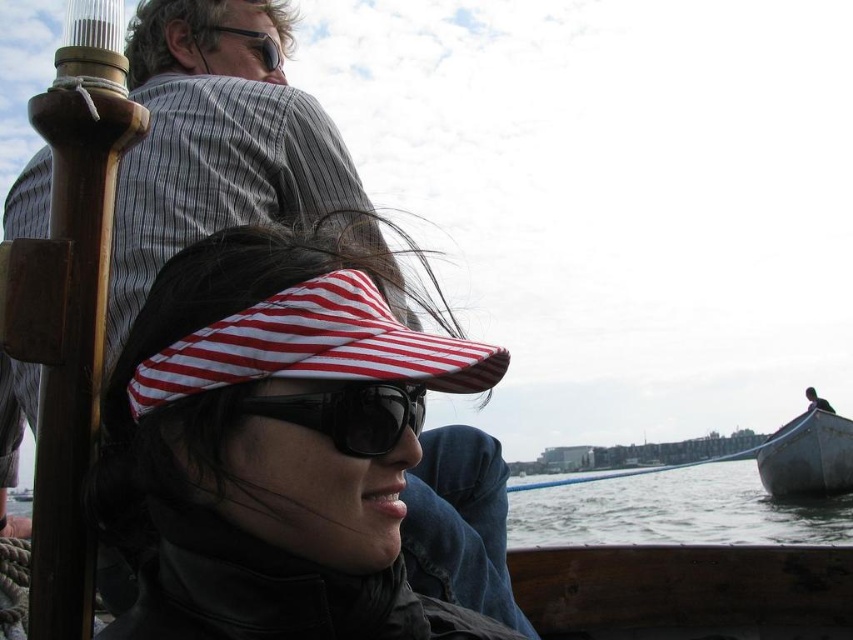
Question: Which point is farther from the camera taking this photo?

Choices:
 (A) (699, 532)
 (B) (144, 336)
 (C) (376, 428)
 (D) (833, 490)

Answer: (A)

Question: Which is farther from the black plastic sunglasses at center?

Choices:
 (A) clear water at lower right
 (B) striped fabric sun visor at center
 (C) dark gray wooden boat at lower right

Answer: (A)

Question: Does striped fabric sun visor at center lie in front of clear water at lower right?

Choices:
 (A) no
 (B) yes

Answer: (B)

Question: Is striped fabric sun visor at center further to the viewer compared to black plastic sunglasses at center?

Choices:
 (A) yes
 (B) no

Answer: (B)

Question: Is black plastic sunglasses at center further to camera compared to dark gray wooden boat at lower right?

Choices:
 (A) no
 (B) yes

Answer: (A)

Question: Which point appears closest to the camera in this image?

Choices:
 (A) (578, 518)
 (B) (387, 346)
 (C) (770, 497)
 (D) (370, 445)

Answer: (D)